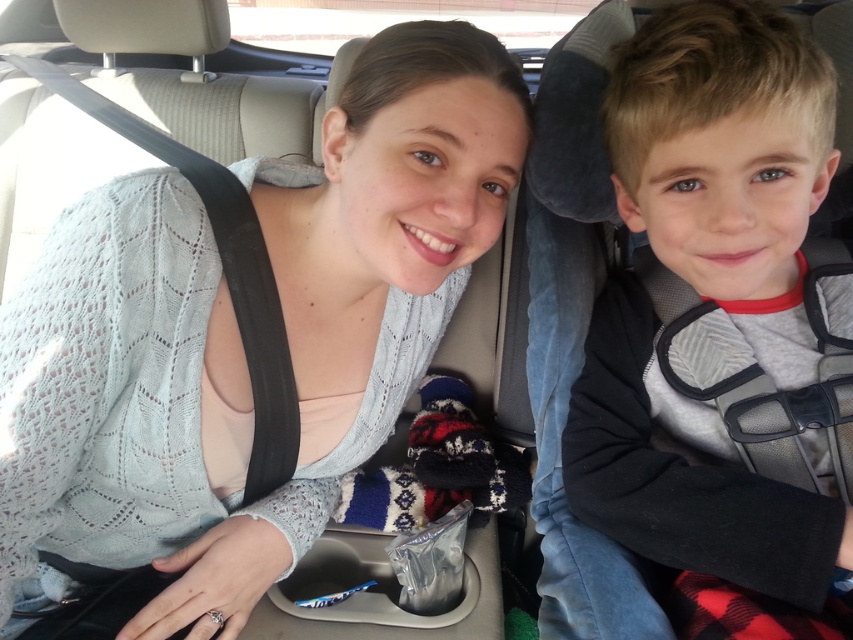
You are a fashion designer observing the image of two people in a car. You notice a point at coordinates (x=241, y=337). What object in the scene corresponds to this point?

The point at coordinates (x=241, y=337) corresponds to the light blue knitted sweater at center.

You are a delivery robot trying to place a package between the light blue knitted sweater at center and the gray fleece jacket at right. The package is 12 inches long. Can you fit it between them without overlapping either item?

The distance between the light blue knitted sweater at center and the gray fleece jacket at right is 12.03 inches. Since the package is 12 inches long, it can fit between them as there is enough space.